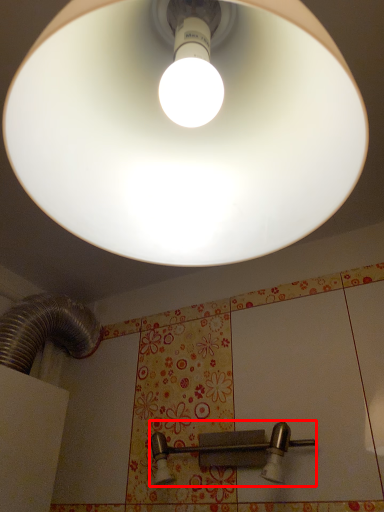
Question: In this image, where is door handle (annotated by the red box) located relative to lamp?

Choices:
 (A) left
 (B) right

Answer: (B)